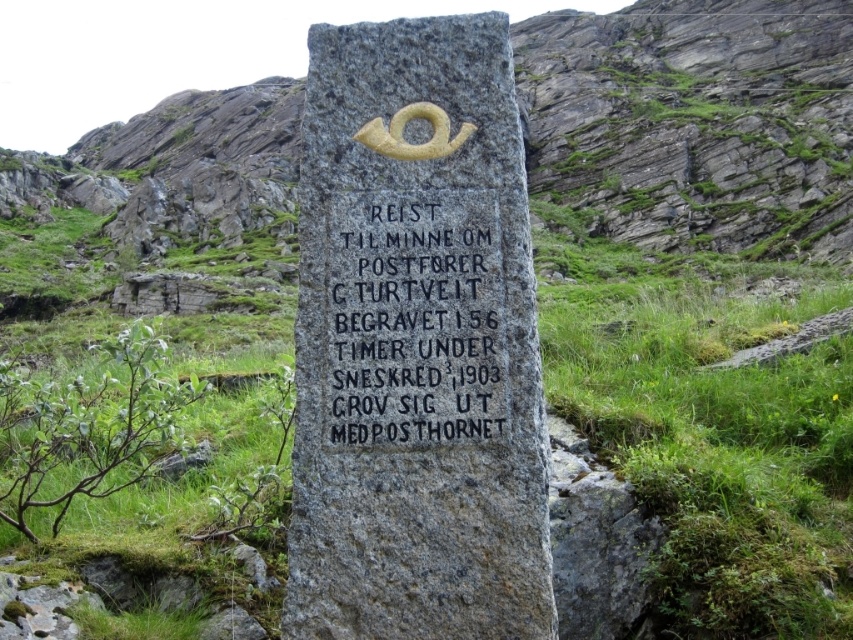
Does gray stone monument at center lie behind black granite stone at center?

No, gray stone monument at center is in front of black granite stone at center.

Does gray stone monument at center have a smaller size compared to black granite stone at center?

Incorrect, gray stone monument at center is not smaller in size than black granite stone at center.

I want to click on gray stone monument at center, so click(x=416, y=342).

Find the location of a particular element. This screenshot has width=853, height=640. gray stone monument at center is located at coordinates (416, 342).